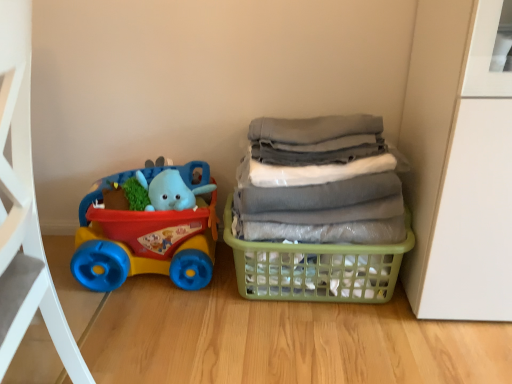
Question: Considering the positions of green plastic basket at right and gray fabric laundry at right in the image, is green plastic basket at right bigger or smaller than gray fabric laundry at right?

Choices:
 (A) small
 (B) big

Answer: (A)

Question: Do you think green plastic basket at right is within gray fabric laundry at right, or outside of it?

Choices:
 (A) inside
 (B) outside

Answer: (B)

Question: Which object is positioned farthest from the green plastic basket at right?

Choices:
 (A) gray fabric laundry at right
 (B) rubberized plastic toy car at left

Answer: (B)

Question: Estimate the real-world distances between objects in this image. Which object is farther from the gray fabric laundry at right?

Choices:
 (A) green plastic basket at right
 (B) rubberized plastic toy car at left

Answer: (B)